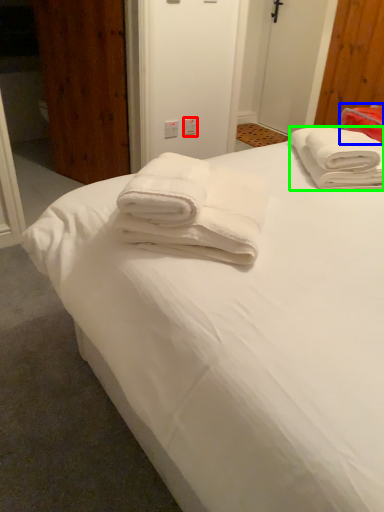
Question: Estimate the real-world distances between objects in this image. Which object is farther from electric outlet (highlighted by a red box), cloth (highlighted by a blue box) or towel (highlighted by a green box)?

Choices:
 (A) cloth
 (B) towel

Answer: (B)